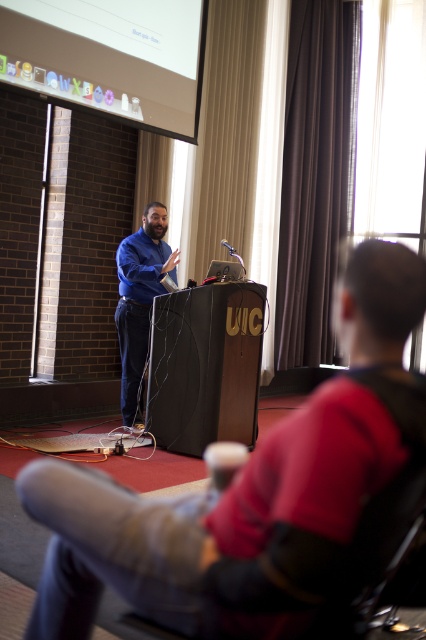
You are organizing a presentation and need to ensure that the blue shirt at center can be seen clearly by the audience. Considering the white glossy projector screen at upper center, which object is wider and might block the view of the speaker?

The white glossy projector screen at upper center is wider than the blue shirt at center, so it might block the speaker from being seen clearly by the audience.